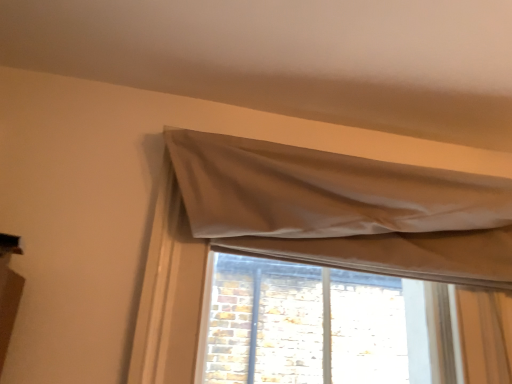
This screenshot has width=512, height=384. In order to click on beige fabric curtain at upper center in this screenshot , I will do `click(304, 228)`.

Describe the element at coordinates (304, 228) in the screenshot. I see `beige fabric curtain at upper center` at that location.

In order to face beige fabric curtain at upper center, should I rotate leftwards or rightwards?

A 10.860 degree turn to the right will do.

Identify the location of beige fabric curtain at upper center. The height and width of the screenshot is (384, 512). (304, 228).